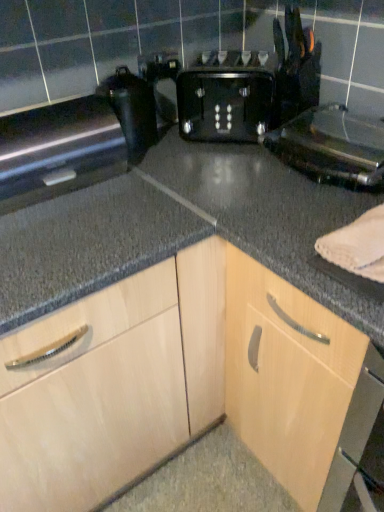
Identify the location of vacant area that lies to the right of black glossy coffee maker at upper left, which appears as the 2th appliance when viewed from the left. (183, 150).